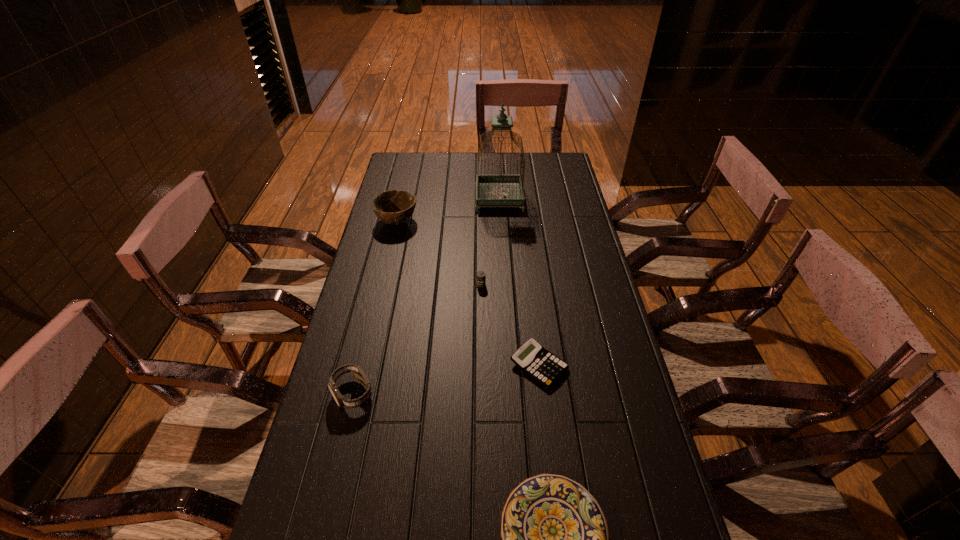
Identify the location of free space between the bowl and the birdcage. The image size is (960, 540). (448, 210).

Locate an element on the screen. free space between the third shortest object and the fifth tallest object is located at coordinates (510, 325).

The image size is (960, 540). What are the coordinates of `vacant space in between the fourth tallest object and the tallest object` in the screenshot? It's located at (491, 241).

Where is `empty location between the birdcage and the beer can`? The width and height of the screenshot is (960, 540). empty location between the birdcage and the beer can is located at coordinates (491, 241).

Find the location of `object that ranks as the third closest to the fourth nearest object`. object that ranks as the third closest to the fourth nearest object is located at coordinates (492, 190).

Select which object is the closest to the third shortest object. Please provide its 2D coordinates. Your answer should be formatted as a tuple, i.e. [(x, y)], where the tuple contains the x and y coordinates of a point satisfying the conditions above.

[(532, 358)]

Find the location of a particular element. This screenshot has width=960, height=540. free space that satisfies the following two spatial constraints: 1. at the door of the tallest object; 2. on the face of the fourth shortest object is located at coordinates (511, 393).